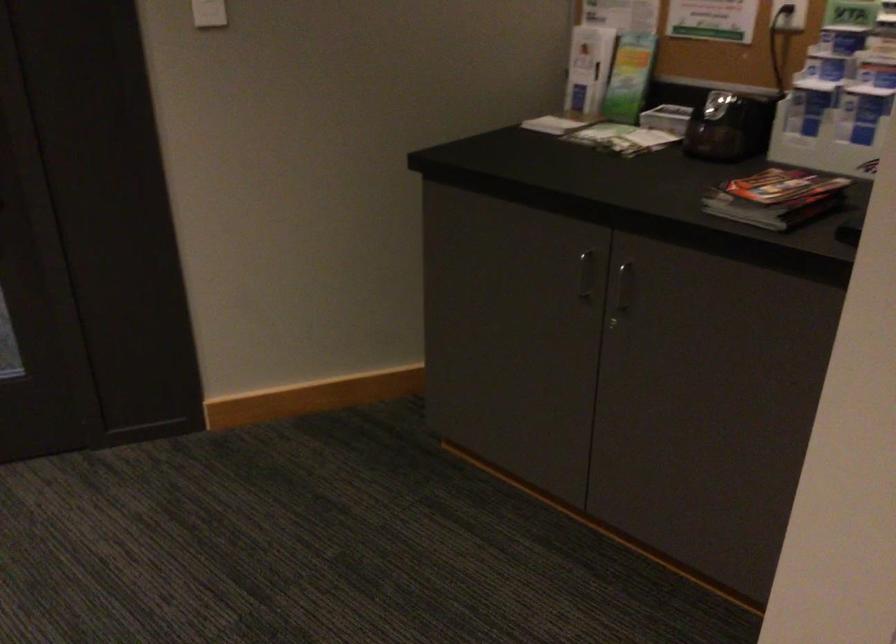
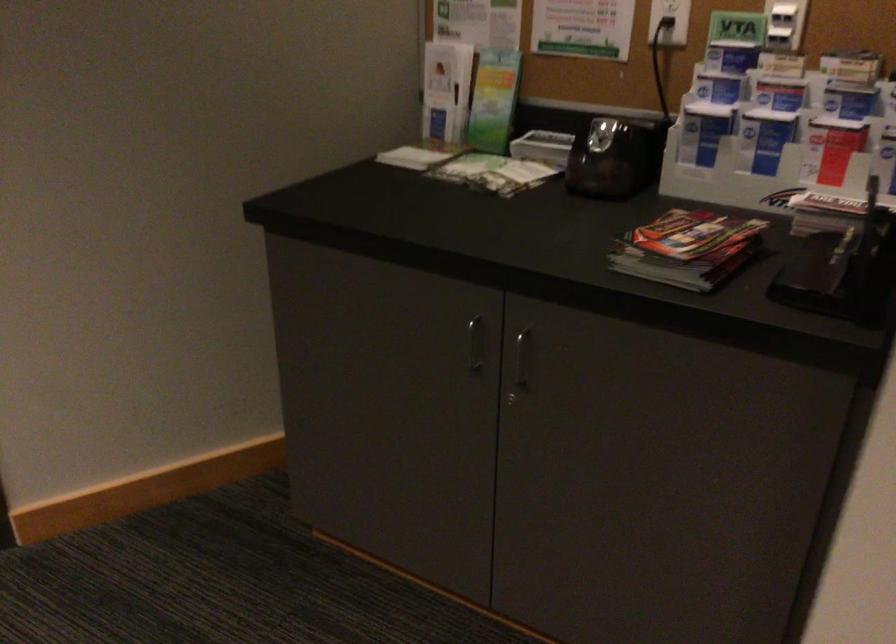
The point at (622, 287) is marked in the first image. Where is the corresponding point in the second image?

(521, 357)